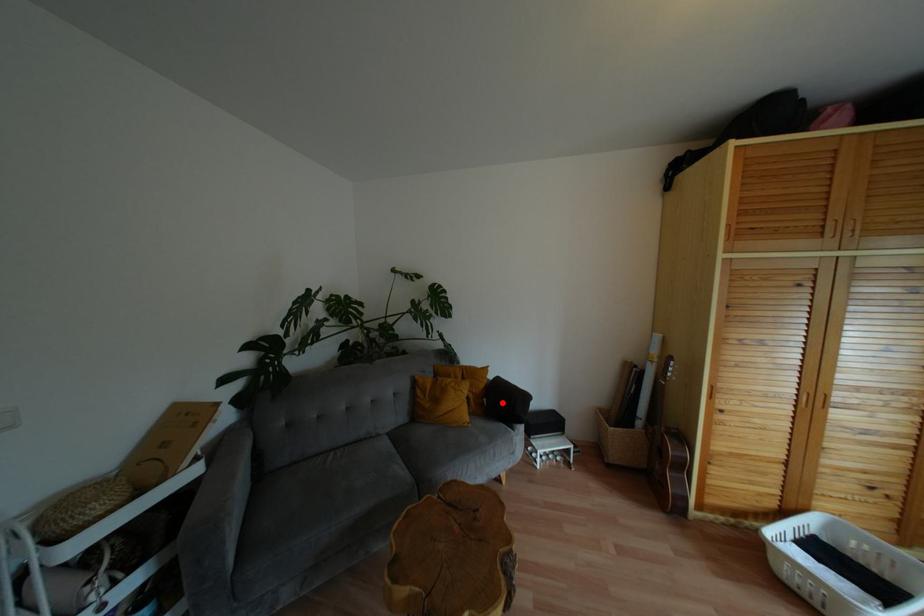
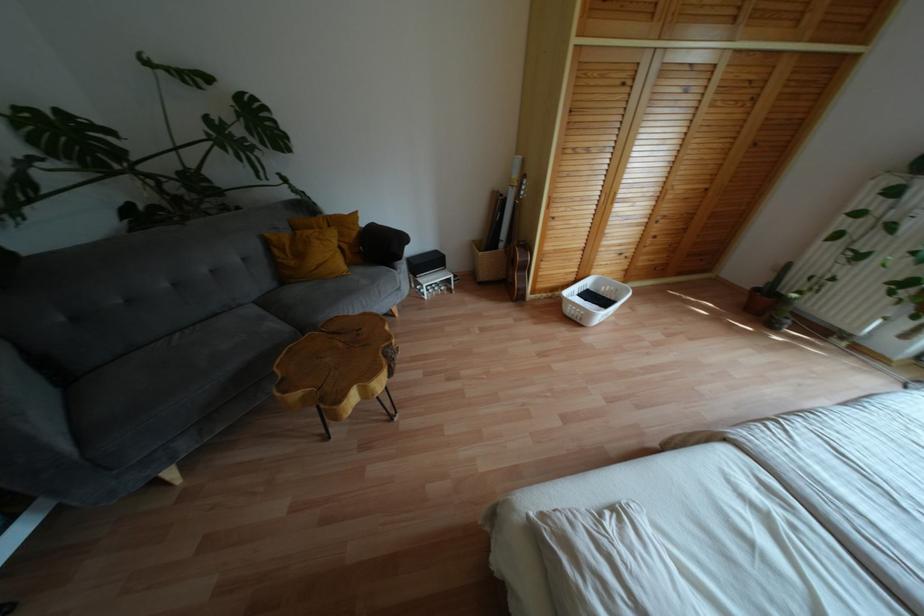
Where in the second image is the point corresponding to the highlighted location from the first image?

(380, 246)